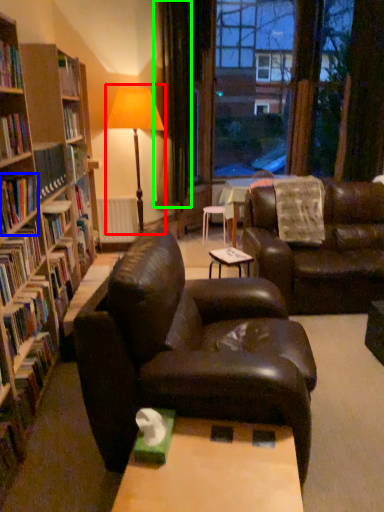
Question: Considering the real-world distances, which object is closest to table lamp (highlighted by a red box)? book (highlighted by a blue box) or curtain (highlighted by a green box).

Choices:
 (A) book
 (B) curtain

Answer: (B)